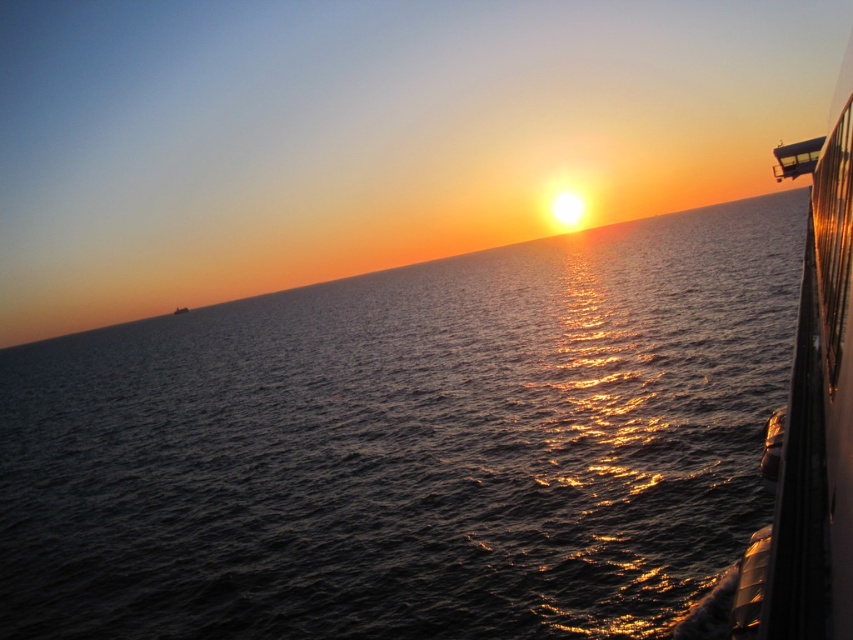
You are a marine biologist studying the water in the image. You need to collect a sample from the dark blue water at center. Based on its position, where exactly would you go to collect the sample?

The dark blue water at center is located at point (410, 445), so you should go to that coordinate to collect the sample.

You are standing on the shore and looking at the dark blue water at center and the white glossy boat at right. Which object appears taller in the image?

The dark blue water at center appears taller than the white glossy boat at right in the image.

You are standing on the deck of a ship and looking at the image. There is a point marked at coordinates point (410, 445). What is located at that point?

The point (410, 445) is occupied by dark blue water at center.